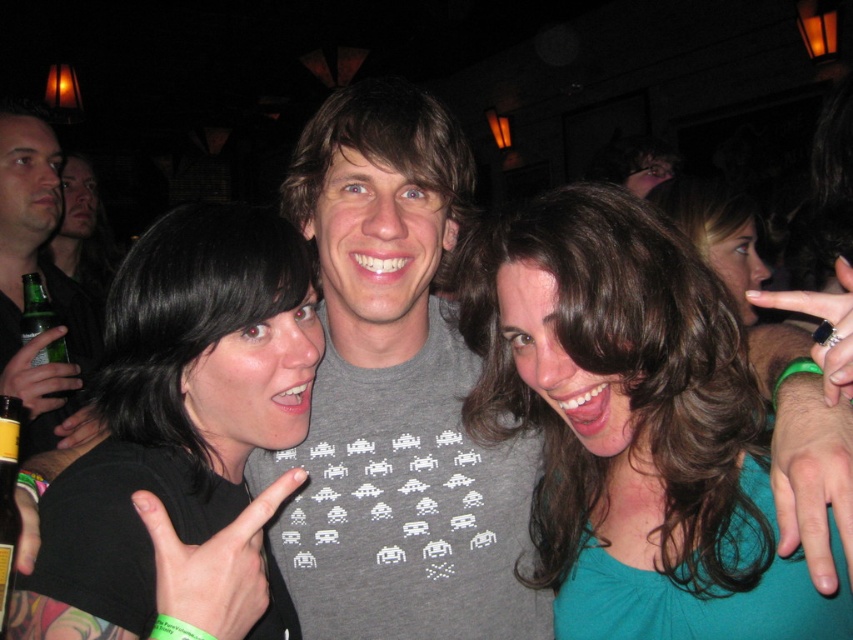
You are at a bar and want to find the person wearing a black matte shirt at center. Where should you look?

You should look at point (183, 433) to find the black matte shirt at center.

You are a photographer at the event and want to ensure both the teal fabric shirt at center and the black matte shirt at center are visible in the photo. Given their height difference, which one might you need to adjust the camera angle for to include both fully?

The teal fabric shirt at center is not as tall as black matte shirt at center, so you should lower the camera angle slightly to ensure the taller black matte shirt at center is fully visible while still capturing the shorter teal fabric shirt at center.

You are at a bar and want to grab the green glass bottle at lower left without touching the black matte shirt at center. Is the bottle small enough to pick up easily?

The black matte shirt at center is larger in size than the green glass bottle at lower left, so the green glass bottle at lower left is small enough to pick up without disturbing the black matte shirt at center.